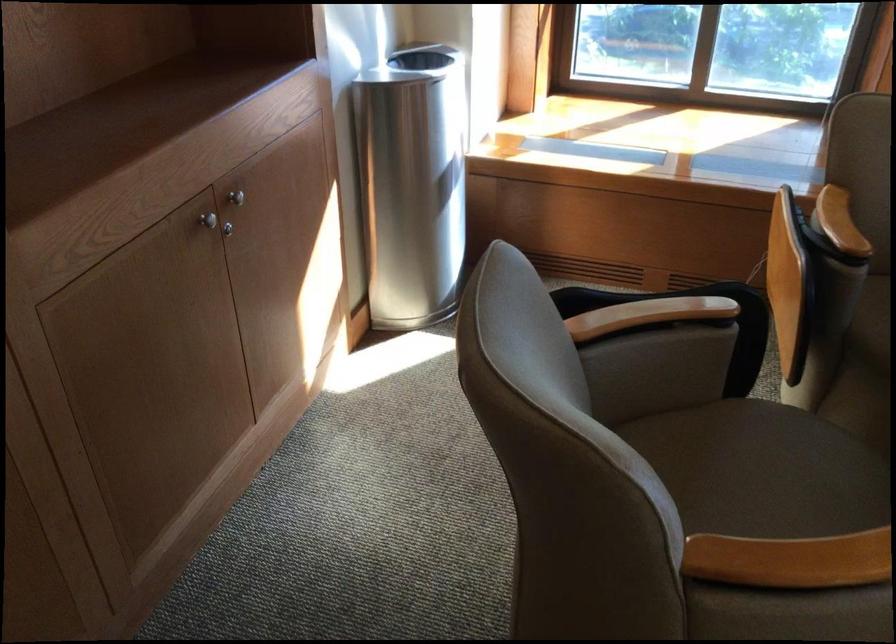
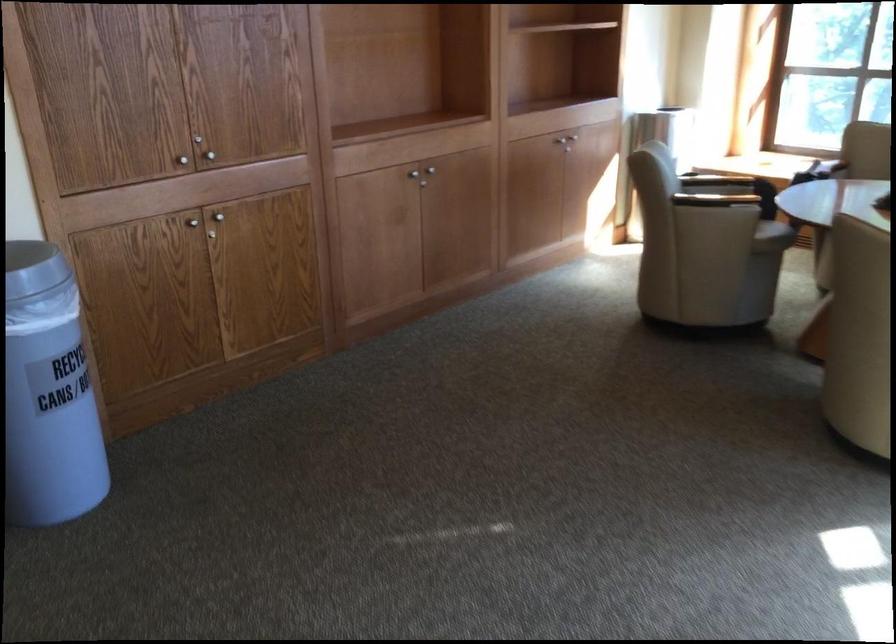
Where in the second image is the point corresponding to [688,357] from the first image?

(731, 178)